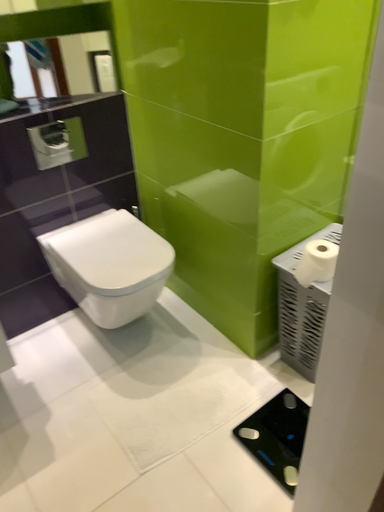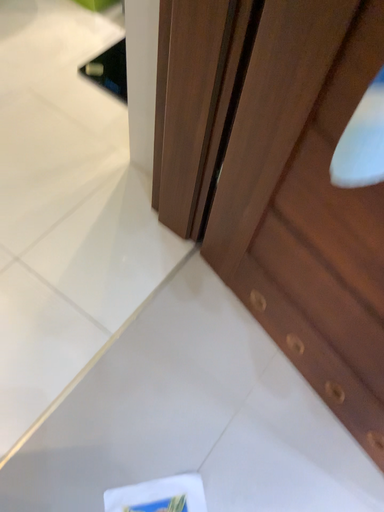
Question: How did the camera likely rotate when shooting the video?

Choices:
 (A) rotated downward
 (B) rotated upward

Answer: (A)